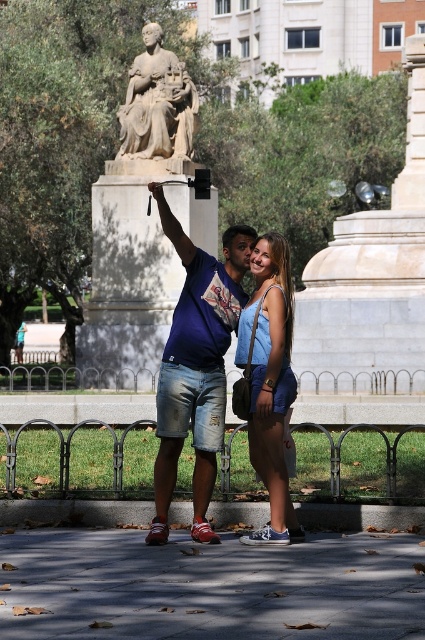
Is point (263, 294) more distant than point (153, 113)?

No, (263, 294) is in front of (153, 113).

Between point (263, 307) and point (176, 93), which one is positioned in front?

Point (263, 307) is in front.

The image size is (425, 640). Describe the element at coordinates (269, 381) in the screenshot. I see `blue denim shorts at center` at that location.

Find the location of a particular element. This screenshot has width=425, height=640. blue denim shorts at center is located at coordinates (269, 381).

Is point (207, 477) closer to camera compared to point (170, 108)?

Yes, point (207, 477) is in front of point (170, 108).

Does point (193, 404) come behind point (156, 42)?

No, it is not.

Identify the location of denim shorts at center. The image size is (425, 640). (195, 365).

Can you confirm if denim shorts at center is positioned above blue denim shorts at center?

Correct, denim shorts at center is located above blue denim shorts at center.

Does point (215, 435) come farther from viewer compared to point (289, 532)?

Yes, it is behind point (289, 532).

Locate an element on the screen. The height and width of the screenshot is (640, 425). denim shorts at center is located at coordinates (195, 365).